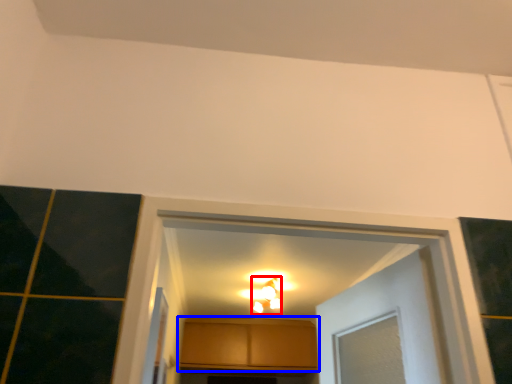
Question: Which of the following is the closest to the observer, light fixture (highlighted by a red box) or cabinetry (highlighted by a blue box)?

Choices:
 (A) light fixture
 (B) cabinetry

Answer: (A)